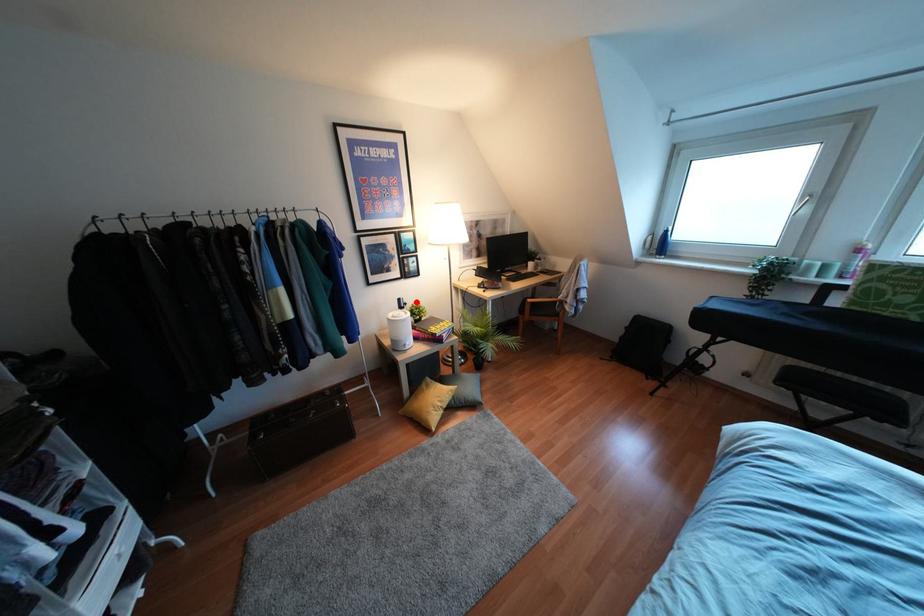
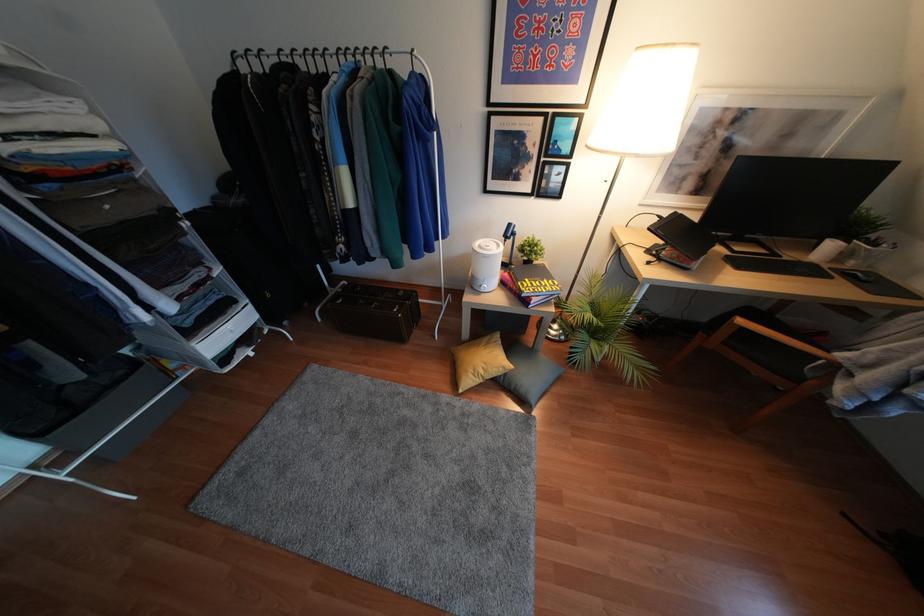
Locate, in the second image, the point that corresponds to the highlighted location in the first image.

(536, 237)